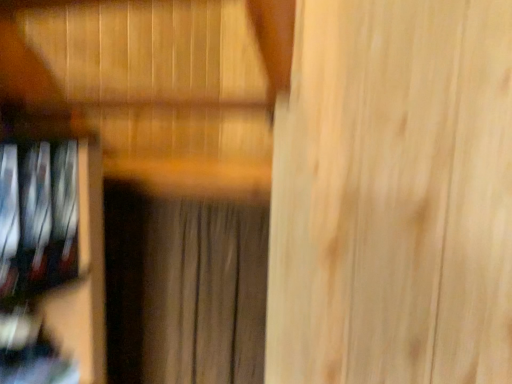
Question: From their relative heights in the image, would you say brown textured curtain at center is taller or shorter than metallic silver dvds at left?

Choices:
 (A) tall
 (B) short

Answer: (A)

Question: From the image's perspective, is brown textured curtain at center positioned above or below metallic silver dvds at left?

Choices:
 (A) below
 (B) above

Answer: (A)

Question: From a real-world perspective, is brown textured curtain at center above or below metallic silver dvds at left?

Choices:
 (A) above
 (B) below

Answer: (B)

Question: Is metallic silver dvds at left taller or shorter than brown textured curtain at center?

Choices:
 (A) tall
 (B) short

Answer: (B)

Question: From the image's perspective, is metallic silver dvds at left above or below brown textured curtain at center?

Choices:
 (A) below
 (B) above

Answer: (B)

Question: Is metallic silver dvds at left situated inside brown textured curtain at center or outside?

Choices:
 (A) outside
 (B) inside

Answer: (A)

Question: Does point (66, 157) appear closer or farther from the camera than point (196, 311)?

Choices:
 (A) closer
 (B) farther

Answer: (A)